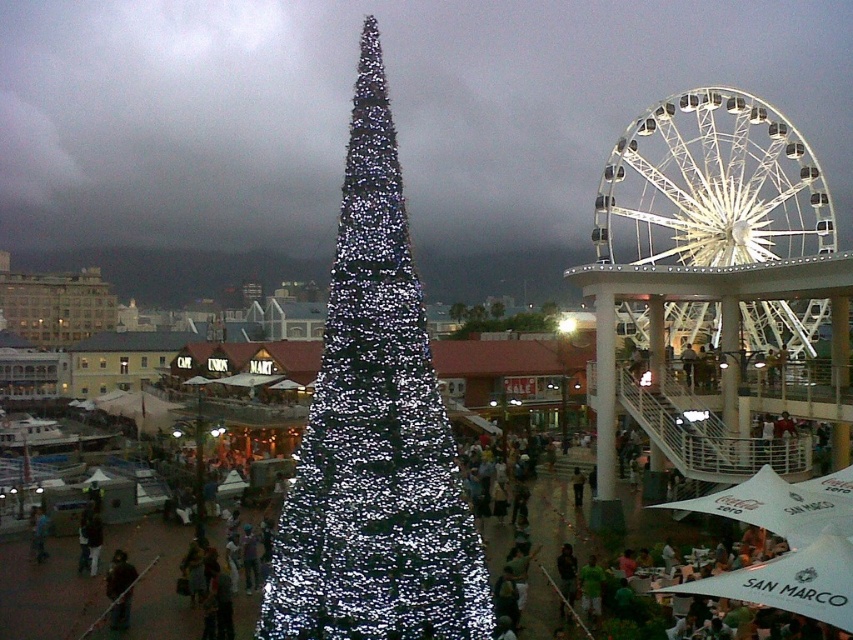
Can you confirm if white metallic ferris wheel at upper right is taller than illuminated plastic tree at center?

Correct, white metallic ferris wheel at upper right is much taller as illuminated plastic tree at center.

Describe the element at coordinates (711, 186) in the screenshot. The width and height of the screenshot is (853, 640). I see `white metallic ferris wheel at upper right` at that location.

You are a GUI agent. You are given a task and a screenshot of the screen. Output one action in this format:
    pyautogui.click(x=<x>, y=<y>)
    Task: Click on the white metallic ferris wheel at upper right
    The width and height of the screenshot is (853, 640).
    Given the screenshot: What is the action you would take?
    pyautogui.click(x=711, y=186)

Which is in front, point (503, 323) or point (112, 572)?

Point (112, 572)

At what (x,y) coordinates should I click in order to perform the action: click on illuminated plastic tree at center. Please return your answer as a coordinate pair (x, y). Looking at the image, I should click on (498, 317).

Identify the location of illuminated plastic tree at center. This screenshot has height=640, width=853. pyautogui.click(x=498, y=317).

Who is more distant from viewer, (743, 115) or (123, 612)?

Point (743, 115)

Can you confirm if white metallic ferris wheel at upper right is taller than dark brown leather jacket at lower left?

Indeed, white metallic ferris wheel at upper right has a greater height compared to dark brown leather jacket at lower left.

Which is in front, point (821, 246) or point (115, 552)?

Point (115, 552) is more forward.

Identify the location of white metallic ferris wheel at upper right. (711, 186).